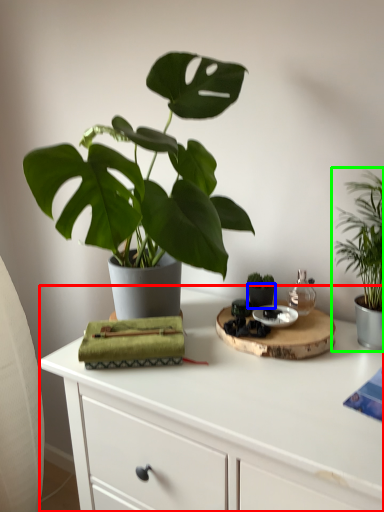
Question: Estimate the real-world distances between objects in this image. Which object is farther from table (highlighted by a red box), flowerpot (highlighted by a blue box) or houseplant (highlighted by a green box)?

Choices:
 (A) flowerpot
 (B) houseplant

Answer: (B)